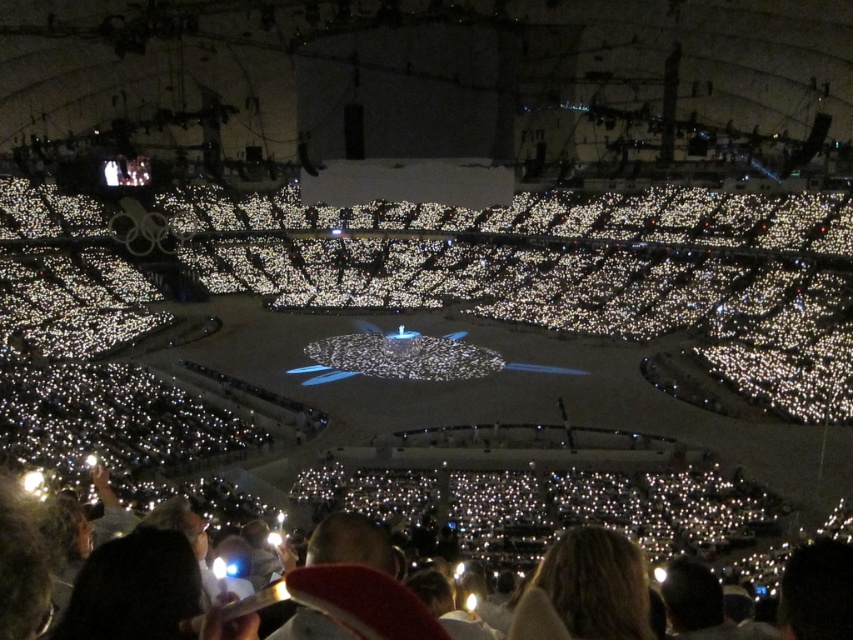
Which is below, white paper at lower center or blonde hair at lower center?

blonde hair at lower center is below.

Is the position of white paper at lower center more distant than that of blonde hair at lower center?

Yes, it is behind blonde hair at lower center.

Is point (608, 520) less distant than point (546, 593)?

That is False.

Locate an element on the screen. white paper at lower center is located at coordinates (608, 508).